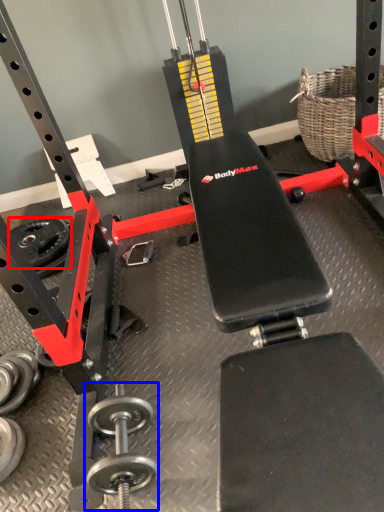
Question: Which of the following is the farthest to the observer, wheel (highlighted by a red box) or dumbbell (highlighted by a blue box)?

Choices:
 (A) wheel
 (B) dumbbell

Answer: (A)